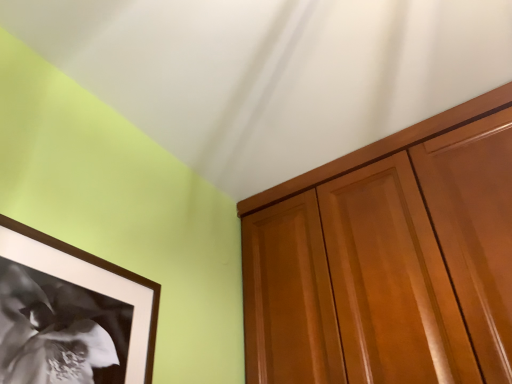
What is the approximate width of black matte picture frame at lower left?

The width of black matte picture frame at lower left is 2.07 inches.

The height and width of the screenshot is (384, 512). What do you see at coordinates (71, 314) in the screenshot?
I see `black matte picture frame at lower left` at bounding box center [71, 314].

The image size is (512, 384). I want to click on black matte picture frame at lower left, so click(71, 314).

What do you see at coordinates (346, 174) in the screenshot? I see `glossy wood cabinet at upper right` at bounding box center [346, 174].

Locate an element on the screen. glossy wood cabinet at upper right is located at coordinates (346, 174).

In order to face glossy wood cabinet at upper right, should I rotate leftwards or rightwards?

You should look right and rotate roughly 18.358 degrees.

At what (x,y) coordinates should I click in order to perform the action: click on black matte picture frame at lower left. Please return your answer as a coordinate pair (x, y). The width and height of the screenshot is (512, 384). Looking at the image, I should click on pyautogui.click(x=71, y=314).

Between black matte picture frame at lower left and glossy wood cabinet at upper right, which one appears on the right side from the viewer's perspective?

Positioned to the right is glossy wood cabinet at upper right.

Is the position of black matte picture frame at lower left less distant than that of glossy wood cabinet at upper right?

Yes, it is.

Which is further, (37, 263) or (244, 210)?

The point (244, 210) is farther from the camera.

From the image's perspective, is black matte picture frame at lower left beneath glossy wood cabinet at upper right?

Yes.

From a real-world perspective, is black matte picture frame at lower left under glossy wood cabinet at upper right?

Yes.

Can you confirm if black matte picture frame at lower left is wider than glossy wood cabinet at upper right?

No, black matte picture frame at lower left is not wider than glossy wood cabinet at upper right.

Considering the sizes of black matte picture frame at lower left and glossy wood cabinet at upper right in the image, is black matte picture frame at lower left taller or shorter than glossy wood cabinet at upper right?

Considering their sizes, black matte picture frame at lower left has less height than glossy wood cabinet at upper right.

Between black matte picture frame at lower left and glossy wood cabinet at upper right, which one has larger size?

glossy wood cabinet at upper right is bigger.

Which is correct: black matte picture frame at lower left is inside glossy wood cabinet at upper right, or outside of it?

The correct answer is: outside.

Is there a large distance between black matte picture frame at lower left and glossy wood cabinet at upper right?

black matte picture frame at lower left is near glossy wood cabinet at upper right, not far away.

Could you tell me if black matte picture frame at lower left is turned towards glossy wood cabinet at upper right?

No, black matte picture frame at lower left is not oriented towards glossy wood cabinet at upper right.

How many degrees apart are the facing directions of black matte picture frame at lower left and glossy wood cabinet at upper right?

The angle between the facing direction of black matte picture frame at lower left and the facing direction of glossy wood cabinet at upper right is 90.4 degrees.

How far apart are black matte picture frame at lower left and glossy wood cabinet at upper right?

They are 57.92 centimeters apart.

Locate an element on the screen. The width and height of the screenshot is (512, 384). picture frame to the left of glossy wood cabinet at upper right is located at coordinates (71, 314).

Considering the positions of objects glossy wood cabinet at upper right and black matte picture frame at lower left in the image provided, who is more to the right, glossy wood cabinet at upper right or black matte picture frame at lower left?

glossy wood cabinet at upper right is more to the right.

Which is in front, glossy wood cabinet at upper right or black matte picture frame at lower left?

black matte picture frame at lower left is in front.

Considering the positions of point (387, 145) and point (129, 351), is point (387, 145) closer or farther from the camera than point (129, 351)?

Point (387, 145) appears to be farther away from the viewer than point (129, 351).

From the image's perspective, between glossy wood cabinet at upper right and black matte picture frame at lower left, which one is located above?

glossy wood cabinet at upper right is shown above in the image.

From a real-world perspective, between glossy wood cabinet at upper right and black matte picture frame at lower left, who is vertically lower?

black matte picture frame at lower left.

From the picture: Which of these two, glossy wood cabinet at upper right or black matte picture frame at lower left, is thinner?

black matte picture frame at lower left.

Looking at this image, is glossy wood cabinet at upper right shorter than black matte picture frame at lower left?

No, glossy wood cabinet at upper right is not shorter than black matte picture frame at lower left.

Based on the photo, between glossy wood cabinet at upper right and black matte picture frame at lower left, which one has smaller size?

black matte picture frame at lower left is smaller.

Is glossy wood cabinet at upper right positioned beyond the bounds of black matte picture frame at lower left?

That's correct, glossy wood cabinet at upper right is outside of black matte picture frame at lower left.

Is glossy wood cabinet at upper right not near black matte picture frame at lower left?

No, glossy wood cabinet at upper right is in close proximity to black matte picture frame at lower left.

Is black matte picture frame at lower left at the back of glossy wood cabinet at upper right?

No, glossy wood cabinet at upper right's orientation is not away from black matte picture frame at lower left.

Can you tell me how much glossy wood cabinet at upper right and black matte picture frame at lower left differ in facing direction?

There is a 90.4-degree angle between the facing directions of glossy wood cabinet at upper right and black matte picture frame at lower left.

Locate an element on the screen. cabinetry on the right of black matte picture frame at lower left is located at coordinates (346, 174).

Find the location of a particular element. picture frame located in front of the glossy wood cabinet at upper right is located at coordinates (71, 314).

Find the location of a particular element. Image resolution: width=512 pixels, height=384 pixels. picture frame beneath the glossy wood cabinet at upper right (from a real-world perspective) is located at coordinates (71, 314).